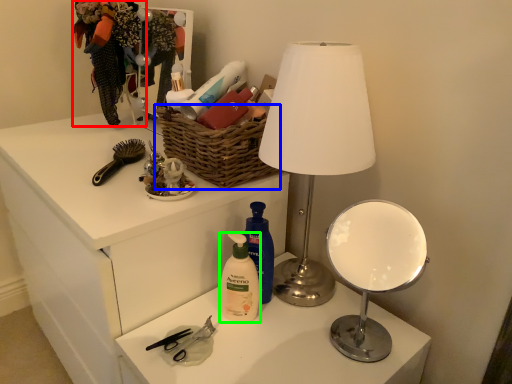
Question: Which object is positioned closest to clothing (highlighted by a red box)? Select from basket (highlighted by a blue box) and cleaning product (highlighted by a green box).

Choices:
 (A) basket
 (B) cleaning product

Answer: (A)